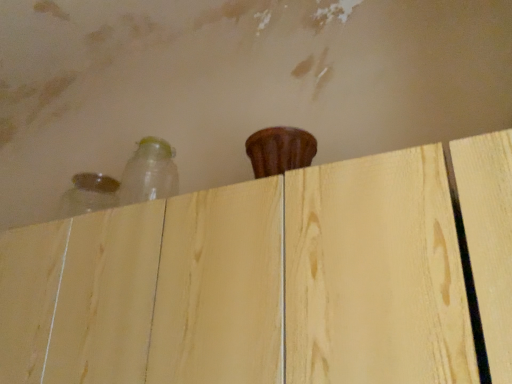
Question: Would you consider light wood dresser at upper center to be distant from translucent glass bottle at upper left, which appears as the 1th bottle when viewed from the left?

Choices:
 (A) no
 (B) yes

Answer: (A)

Question: Is light wood dresser at upper center bigger than translucent glass bottle at upper left, which appears as the 1th bottle when viewed from the left?

Choices:
 (A) no
 (B) yes

Answer: (B)

Question: From the image's perspective, is light wood dresser at upper center on top of translucent glass bottle at upper left, which appears as the 1th bottle when viewed from the left?

Choices:
 (A) no
 (B) yes

Answer: (A)

Question: Is translucent glass bottle at upper left, the 2th bottle when ordered from right to left, at the back of light wood dresser at upper center?

Choices:
 (A) yes
 (B) no

Answer: (B)

Question: Is light wood dresser at upper center shorter than translucent glass bottle at upper left, the 2th bottle when ordered from right to left?

Choices:
 (A) yes
 (B) no

Answer: (B)

Question: From the image's perspective, is translucent glass bottle at upper left, which appears as the 1th bottle when viewed from the left, above or below light wood dresser at upper center?

Choices:
 (A) above
 (B) below

Answer: (A)

Question: Based on their sizes in the image, would you say translucent glass bottle at upper left, which appears as the 1th bottle when viewed from the left, is bigger or smaller than light wood dresser at upper center?

Choices:
 (A) small
 (B) big

Answer: (A)

Question: Which is correct: translucent glass bottle at upper left, the 2th bottle when ordered from right to left, is inside light wood dresser at upper center, or outside of it?

Choices:
 (A) inside
 (B) outside

Answer: (B)

Question: From a real-world perspective, relative to light wood dresser at upper center, is translucent glass bottle at upper left, the 2th bottle when ordered from right to left, vertically above or below?

Choices:
 (A) below
 (B) above

Answer: (B)

Question: Based on their positions, is transparent plastic bottle at upper left, the second bottle from the left, located to the left or right of translucent glass bottle at upper left, which appears as the 1th bottle when viewed from the left?

Choices:
 (A) left
 (B) right

Answer: (B)

Question: Is transparent plastic bottle at upper left, marked as the 1th bottle in a right-to-left arrangement, in front of or behind translucent glass bottle at upper left, the 2th bottle when ordered from right to left, in the image?

Choices:
 (A) front
 (B) behind

Answer: (A)

Question: Is transparent plastic bottle at upper left, the second bottle from the left, inside the boundaries of translucent glass bottle at upper left, the 2th bottle when ordered from right to left, or outside?

Choices:
 (A) outside
 (B) inside

Answer: (A)

Question: From a real-world perspective, is transparent plastic bottle at upper left, marked as the 1th bottle in a right-to-left arrangement, positioned above or below translucent glass bottle at upper left, the 2th bottle when ordered from right to left?

Choices:
 (A) above
 (B) below

Answer: (A)

Question: Choose the correct answer: Is light wood dresser at upper center inside transparent plastic bottle at upper left, marked as the 1th bottle in a right-to-left arrangement, or outside it?

Choices:
 (A) outside
 (B) inside

Answer: (A)

Question: In terms of size, does light wood dresser at upper center appear bigger or smaller than transparent plastic bottle at upper left, the second bottle from the left?

Choices:
 (A) small
 (B) big

Answer: (B)